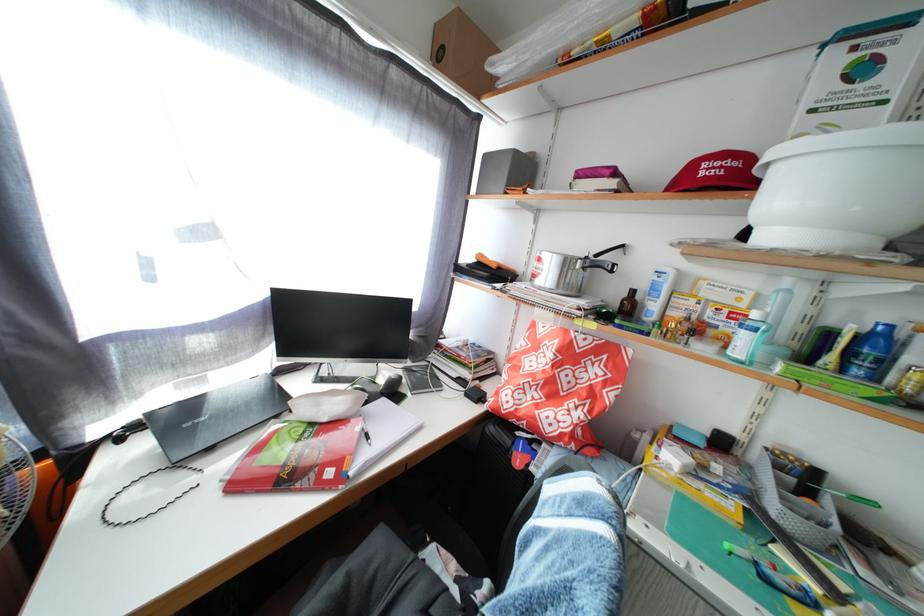
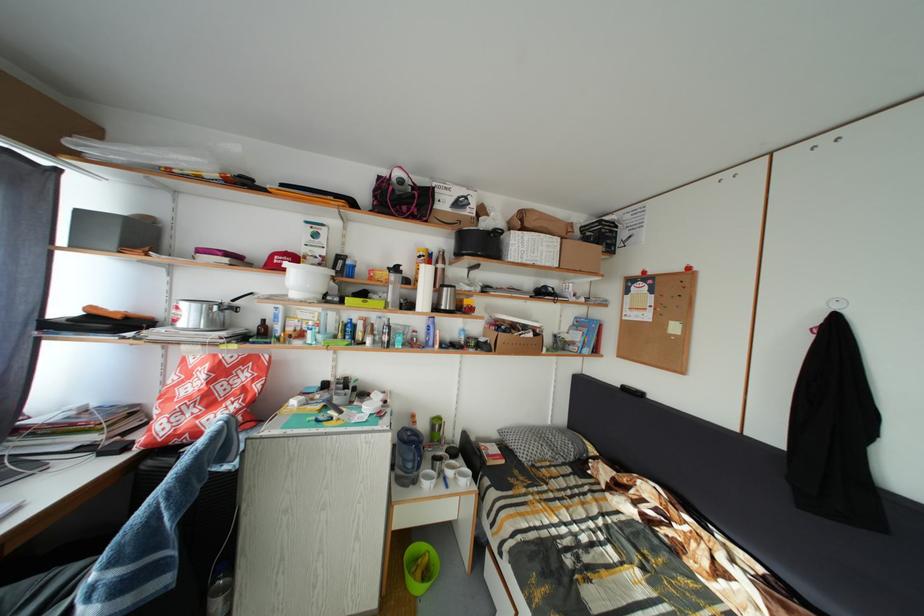
Where in the second image is the point corresponding to [712,172] from the first image?

(285, 264)